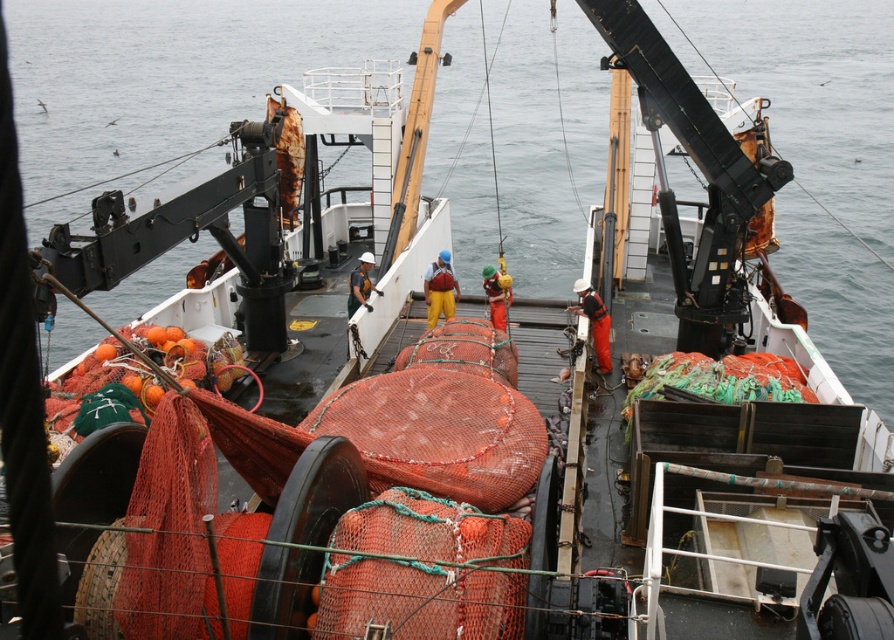
Question: Does yellow fabric at center appear on the right side of matte orange net at center?

Choices:
 (A) yes
 (B) no

Answer: (A)

Question: Among these objects, which one is farthest from the camera?

Choices:
 (A) orange fabric at center
 (B) matte orange net at center
 (C) orange fabric worker at center

Answer: (B)

Question: Does yellow fabric at center appear on the left side of matte orange net at center?

Choices:
 (A) yes
 (B) no

Answer: (B)

Question: Observing the image, what is the correct spatial positioning of yellow fabric at center in reference to orange fabric worker at center?

Choices:
 (A) right
 (B) left

Answer: (B)

Question: Considering the real-world distances, which object is closest to the orange fabric worker at center?

Choices:
 (A) orange fabric at center
 (B) matte orange net at center

Answer: (A)

Question: Which point appears closest to the camera in this image?

Choices:
 (A) (367, 292)
 (B) (596, 330)
 (C) (436, 284)

Answer: (B)